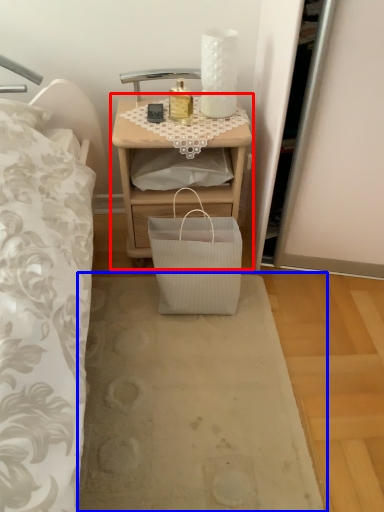
Question: Among these objects, which one is farthest to the camera, nightstand (highlighted by a red box) or plain (highlighted by a blue box)?

Choices:
 (A) nightstand
 (B) plain

Answer: (A)